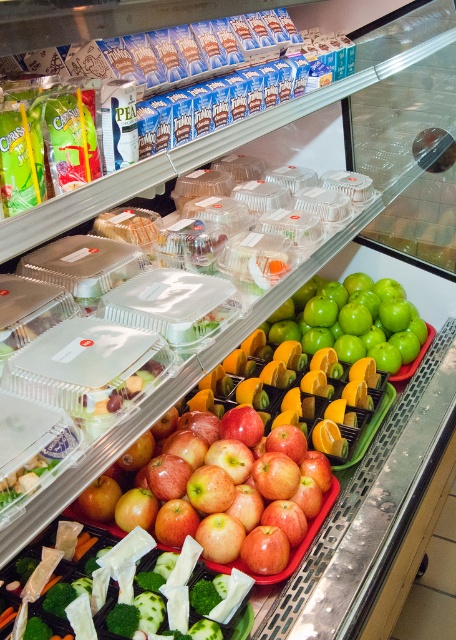
Question: Which object is positioned farthest from the red matte apples at center?

Choices:
 (A) green matte apples at center
 (B) green leafy vegetables at center

Answer: (A)

Question: In this image, where is red matte apples at center located relative to green matte apples at center?

Choices:
 (A) above
 (B) below

Answer: (B)

Question: Can you confirm if red matte apples at center is positioned to the right of green matte apples at center?

Choices:
 (A) yes
 (B) no

Answer: (B)

Question: Which object appears farthest from the camera in this image?

Choices:
 (A) green leafy vegetables at center
 (B) green matte apples at center

Answer: (B)

Question: Can you confirm if red matte apples at center is positioned above green matte apples at center?

Choices:
 (A) yes
 (B) no

Answer: (B)

Question: Which of the following is the closest to the observer?

Choices:
 (A) green matte apples at center
 (B) green leafy vegetables at center

Answer: (B)